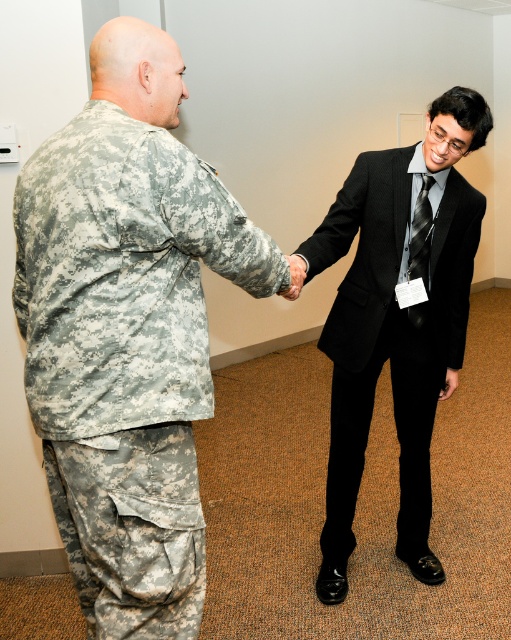
You are a photographer setting up for a group photo in the scene. The camouflage fabric uniform at left and the black silk suit at center must be visible in the frame. Which object should you position closer to the camera to ensure both are clearly visible?

The camouflage fabric uniform at left is smaller than the black silk suit at center. To ensure both are clearly visible, position the camouflage fabric uniform at left closer to the camera since it is smaller and needs to be enlarged in the frame to match the size of the black silk suit at center.

You are a photographer setting up for a formal event. You need to adjust the height of the camera stand so that both the camouflage fabric uniform at left and the black silk suit at center are fully visible in the frame. Given their height difference, which uniform should you ensure is positioned closer to the camera to avoid being cut off?

The camouflage fabric uniform at left is shorter than the black silk suit at center. To ensure both are fully visible, position the camouflage fabric uniform at left closer to the camera so its shorter height remains in frame while the taller black silk suit at center is slightly farther back.

You are a photographer trying to capture a closeup of the black silk suit at center and the black textured tie at center. Since you want to focus on the details of the suit, which object should you adjust your camera focus to prioritize? Please explain your reasoning based on their positions.

The black silk suit at center is below the black textured tie at center. To prioritize focusing on the suit, adjust the camera focus to the lower area where the black silk suit at center is located.